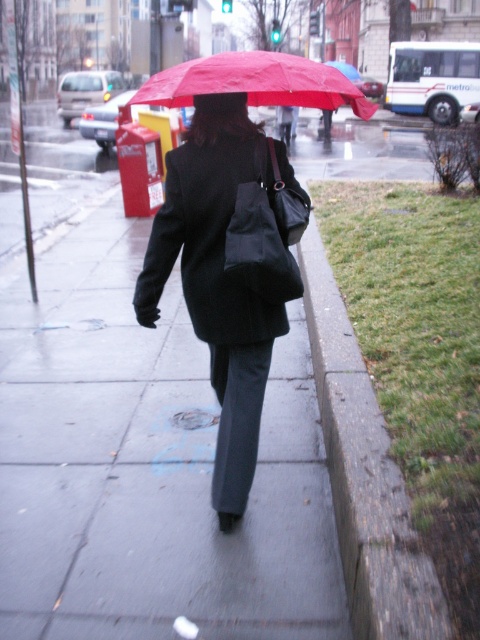
Question: Observing the image, what is the correct spatial positioning of matte black coat at center in reference to concrete at lower right?

Choices:
 (A) below
 (B) above

Answer: (B)

Question: Considering the relative positions of gray concrete sidewalk at center and matte black coat at center in the image provided, where is gray concrete sidewalk at center located with respect to matte black coat at center?

Choices:
 (A) above
 (B) below

Answer: (B)

Question: Does gray concrete sidewalk at center have a lesser width compared to concrete at lower right?

Choices:
 (A) yes
 (B) no

Answer: (B)

Question: Which point is farther to the camera?

Choices:
 (A) red matte umbrella at upper center
 (B) gray concrete sidewalk at center
 (C) concrete at lower right

Answer: (A)

Question: Which object is positioned farthest from the gray concrete sidewalk at center?

Choices:
 (A) concrete at lower right
 (B) red matte umbrella at upper center
 (C) matte black coat at center

Answer: (B)

Question: Which point is closer to the camera?

Choices:
 (A) concrete at lower right
 (B) gray concrete sidewalk at center
 (C) matte black coat at center
 (D) red matte umbrella at upper center

Answer: (A)